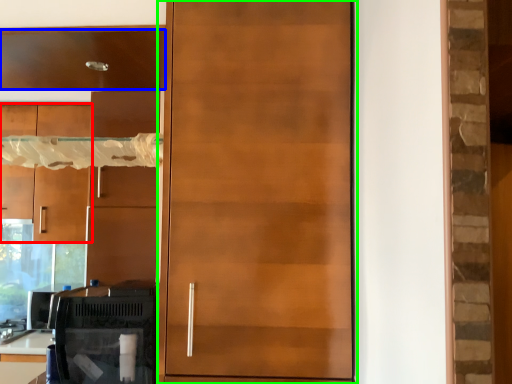
Question: Estimate the real-world distances between objects in this image. Which object is farther from cabinetry (highlighted by a red box), cabinetry (highlighted by a blue box) or door (highlighted by a green box)?

Choices:
 (A) cabinetry
 (B) door

Answer: (B)